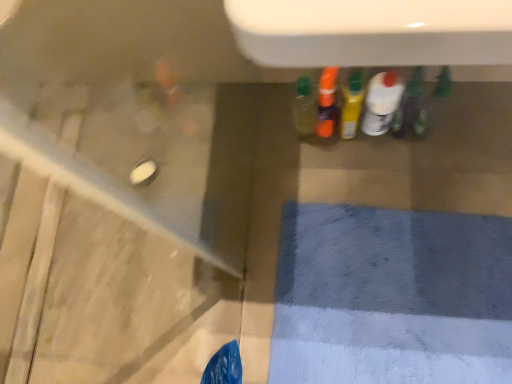
Question: Is translucent plastic bottle at center, which ranks as the third bottle in left-to-right order, at the left side of white glossy bottle at center, the second bottle positioned from the right?

Choices:
 (A) yes
 (B) no

Answer: (A)

Question: From a real-world perspective, is translucent plastic bottle at center, which ranks as the third bottle in left-to-right order, positioned under white glossy bottle at center, the fourth bottle positioned from the left, based on gravity?

Choices:
 (A) no
 (B) yes

Answer: (A)

Question: Is translucent plastic bottle at center, arranged as the third bottle when viewed from the right, thinner than white glossy bottle at center, the fourth bottle positioned from the left?

Choices:
 (A) no
 (B) yes

Answer: (A)

Question: Is the depth of translucent plastic bottle at center, which ranks as the third bottle in left-to-right order, greater than that of white glossy bottle at center, the fourth bottle positioned from the left?

Choices:
 (A) yes
 (B) no

Answer: (B)

Question: From the image's perspective, is translucent plastic bottle at center, which ranks as the third bottle in left-to-right order, below white glossy bottle at center, the fourth bottle positioned from the left?

Choices:
 (A) yes
 (B) no

Answer: (B)

Question: Is translucent plastic bottle at center, arranged as the third bottle when viewed from the right, to the right of white glossy bottle at center, the second bottle positioned from the right, from the viewer's perspective?

Choices:
 (A) no
 (B) yes

Answer: (A)

Question: Would you say green matte bottle at center, marked as the 1th bottle in a right-to-left arrangement, is a long distance from translucent plastic bottle at center, the fifth bottle positioned from the right?

Choices:
 (A) no
 (B) yes

Answer: (A)

Question: Can you confirm if green matte bottle at center, which ranks as the 5th bottle in left-to-right order, is smaller than translucent plastic bottle at center, placed as the first bottle when sorted from left to right?

Choices:
 (A) yes
 (B) no

Answer: (A)

Question: Considering the relative sizes of green matte bottle at center, marked as the 1th bottle in a right-to-left arrangement, and translucent plastic bottle at center, placed as the first bottle when sorted from left to right, in the image provided, is green matte bottle at center, marked as the 1th bottle in a right-to-left arrangement, thinner than translucent plastic bottle at center, placed as the first bottle when sorted from left to right,?

Choices:
 (A) yes
 (B) no

Answer: (B)

Question: Is green matte bottle at center, marked as the 1th bottle in a right-to-left arrangement, surrounding translucent plastic bottle at center, the fifth bottle positioned from the right?

Choices:
 (A) no
 (B) yes

Answer: (A)

Question: Are green matte bottle at center, which ranks as the 5th bottle in left-to-right order, and translucent plastic bottle at center, placed as the first bottle when sorted from left to right, beside each other?

Choices:
 (A) no
 (B) yes

Answer: (A)

Question: Can you confirm if green matte bottle at center, which ranks as the 5th bottle in left-to-right order, is shorter than translucent plastic bottle at center, placed as the first bottle when sorted from left to right?

Choices:
 (A) no
 (B) yes

Answer: (B)

Question: Is green matte bottle at center, marked as the 1th bottle in a right-to-left arrangement, completely or partially outside of white glossy bottle at center, the second bottle positioned from the right?

Choices:
 (A) yes
 (B) no

Answer: (A)